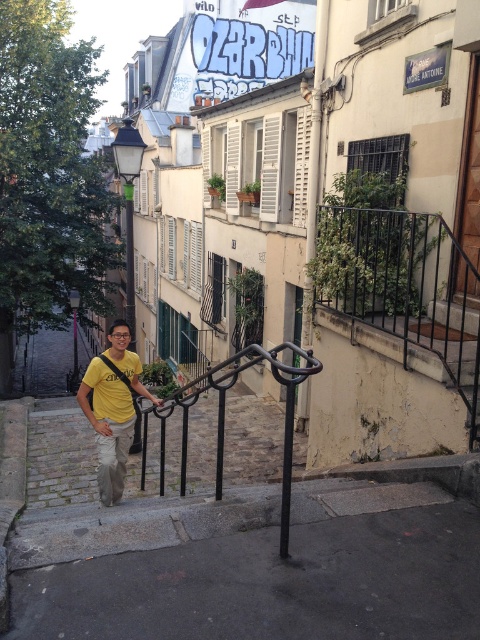
You are a photographer trying to capture the entire scene of the black metal rail at center and the yellow matte polo shirt at lower left in one shot. Based on their sizes, will you need to zoom in or out to ensure both are fully visible?

The black metal rail at center is taller than the yellow matte polo shirt at lower left, so you will need to zoom out to ensure both are fully visible in the frame.

You are a photographer standing in the urban scene and want to capture a photo of the black metal rail at center and the yellow matte shirt at center. Which object would appear taller in the photo?

The black metal rail at center would appear taller in the photo since it is much taller than the yellow matte shirt at center according to the description.